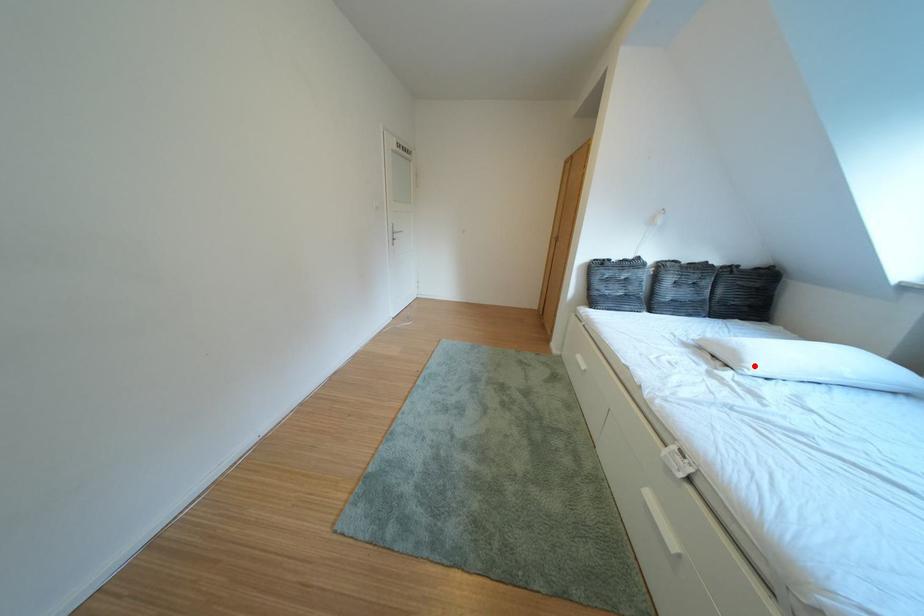
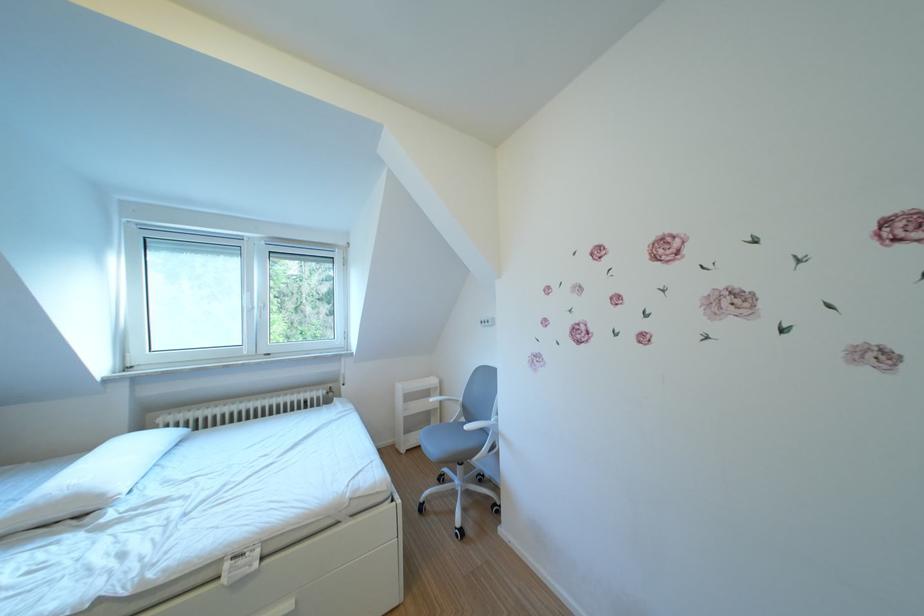
Find the pixel in the second image that matches the highlighted location in the first image.

(115, 501)